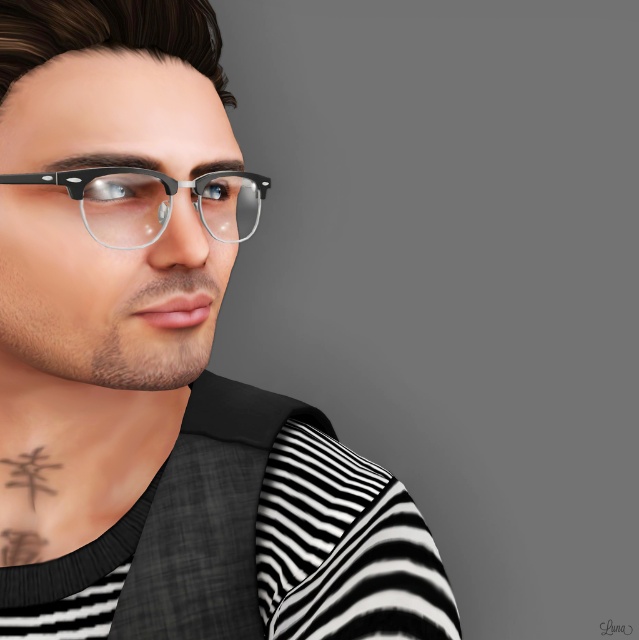
At what (x,y) coordinates should I click in order to perform the action: click on matte black vest at center. Please return your answer as a coordinate pair (x, y). This screenshot has height=640, width=639. Looking at the image, I should click on (162, 365).

Does matte black vest at center have a larger size compared to black matte tattoo at lower left?

Yes.

Which is in front, point (86, 61) or point (146, 408)?

Point (86, 61) is more forward.

The height and width of the screenshot is (640, 639). I want to click on matte black vest at center, so click(162, 365).

Which of these two, matte black vest at center or matte black frame glasses at upper left, stands shorter?

Standing shorter between the two is matte black frame glasses at upper left.

Between point (50, 387) and point (86, 214), which one is positioned in front?

Point (86, 214) is in front.

Where is `matte black vest at center`? Image resolution: width=639 pixels, height=640 pixels. matte black vest at center is located at coordinates [x=162, y=365].

Does black matte tattoo at lower left have a greater height compared to matte black frame glasses at upper left?

Correct, black matte tattoo at lower left is much taller as matte black frame glasses at upper left.

Is point (19, 404) farther from camera compared to point (233, 202)?

Yes, it is.

You are a GUI agent. You are given a task and a screenshot of the screen. Output one action in this format:
    pyautogui.click(x=<x>, y=<y>)
    Task: Click on the black matte tattoo at lower left
    The image size is (639, 640).
    Given the screenshot: What is the action you would take?
    pyautogui.click(x=77, y=452)